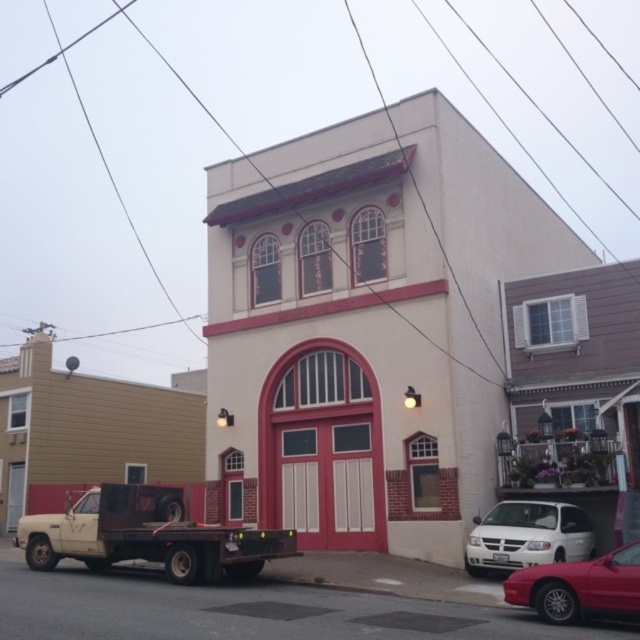
Does point (44, 531) lie in front of point (624, 568)?

No, it is behind (624, 568).

Measure the distance between beige matte flatbed truck at lower left and shiny red sedan at lower right.

The distance of beige matte flatbed truck at lower left from shiny red sedan at lower right is 26.44 feet.

Is point (70, 554) positioned in front of point (536, 586)?

No, (70, 554) is further to viewer.

The width and height of the screenshot is (640, 640). Identify the location of beige matte flatbed truck at lower left. (148, 536).

Looking at this image, which is more to the left, beige matte flatbed truck at lower left or white matte van at lower right?

From the viewer's perspective, beige matte flatbed truck at lower left appears more on the left side.

Which is in front, point (97, 524) or point (540, 525)?

Point (97, 524) is more forward.

Find the location of `beige matte flatbed truck at lower left`. beige matte flatbed truck at lower left is located at coordinates pyautogui.click(x=148, y=536).

Is point (612, 573) positioned behind point (570, 556)?

No, it is in front of (570, 556).

The image size is (640, 640). I want to click on shiny red sedan at lower right, so click(579, 588).

The height and width of the screenshot is (640, 640). What are the coordinates of `shiny red sedan at lower right` in the screenshot? It's located at (579, 588).